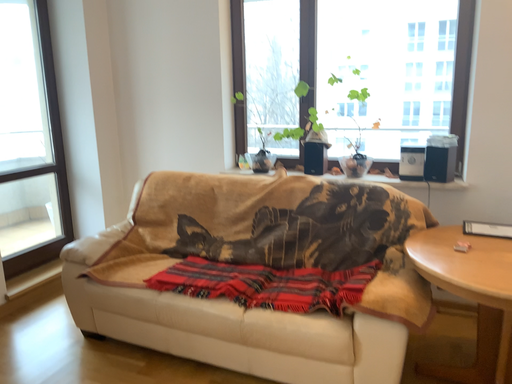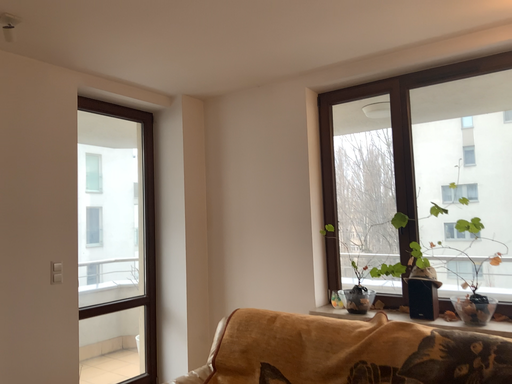
Question: How did the camera likely rotate when shooting the video?

Choices:
 (A) rotated upward
 (B) rotated downward

Answer: (A)